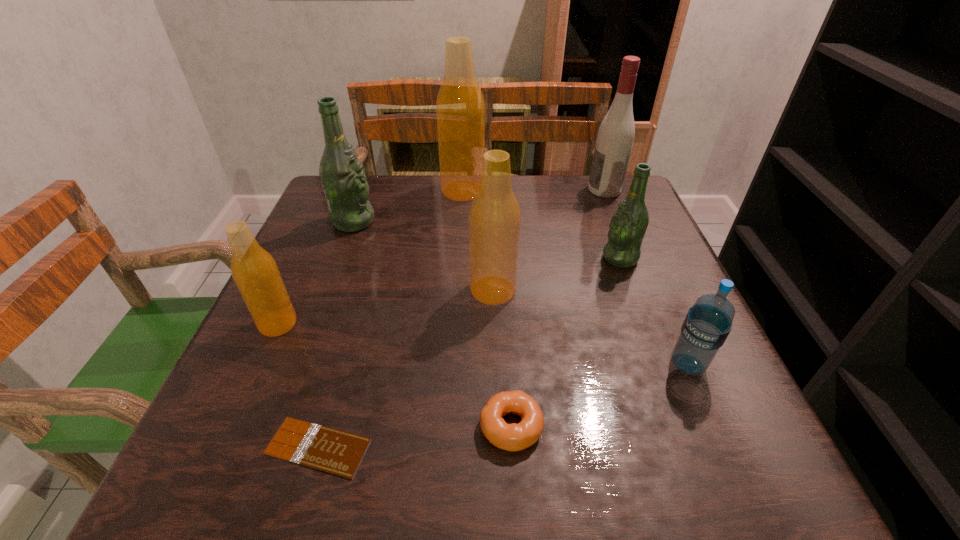
At what (x,y) coordinates should I click in order to perform the action: click on the nearer green beer bottle. Please return your answer as a coordinate pair (x, y). The width and height of the screenshot is (960, 540). Looking at the image, I should click on (628, 225).

Identify the location of water bottle. (708, 322).

Locate an element on the screen. The height and width of the screenshot is (540, 960). the third nearest object is located at coordinates (708, 322).

Where is `doughnut`? The image size is (960, 540). doughnut is located at coordinates (513, 437).

This screenshot has height=540, width=960. Identify the location of the eighth tallest object. (513, 437).

You are a GUI agent. You are given a task and a screenshot of the screen. Output one action in this format:
    pyautogui.click(x=<x>, y=<y>)
    Task: Click on the shortest object
    The image size is (960, 540).
    Given the screenshot: What is the action you would take?
    pyautogui.click(x=337, y=452)

Where is `free space located on the front of the farthest tan beer bottle`? free space located on the front of the farthest tan beer bottle is located at coordinates (456, 310).

Identify the location of vacant region located 0.050m on the label of the alcohol. (569, 190).

Image resolution: width=960 pixels, height=540 pixels. What are the coordinates of `vacant region located 0.400m on the label of the alcohol` in the screenshot? It's located at (441, 190).

The width and height of the screenshot is (960, 540). I want to click on free location located 0.110m on the label of the alcohol, so click(547, 190).